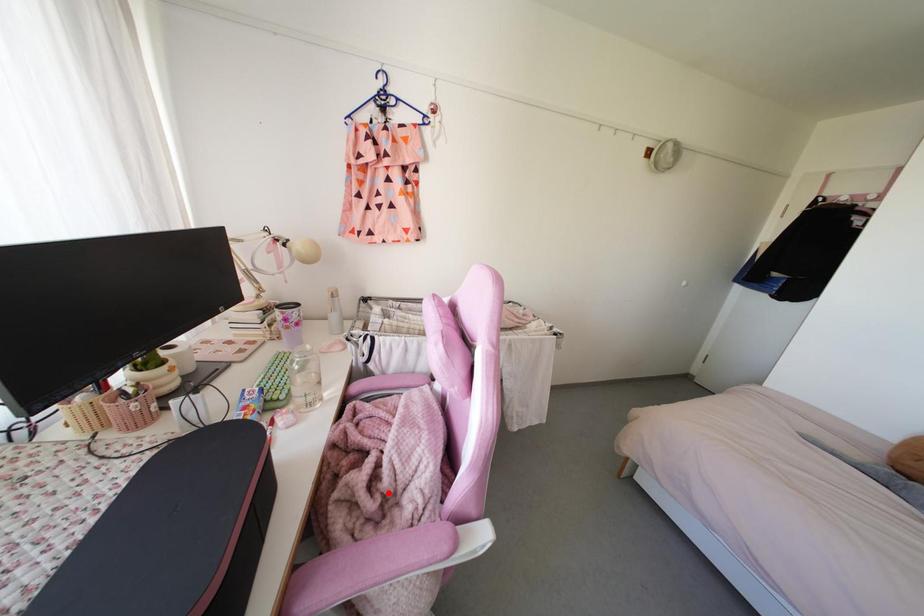
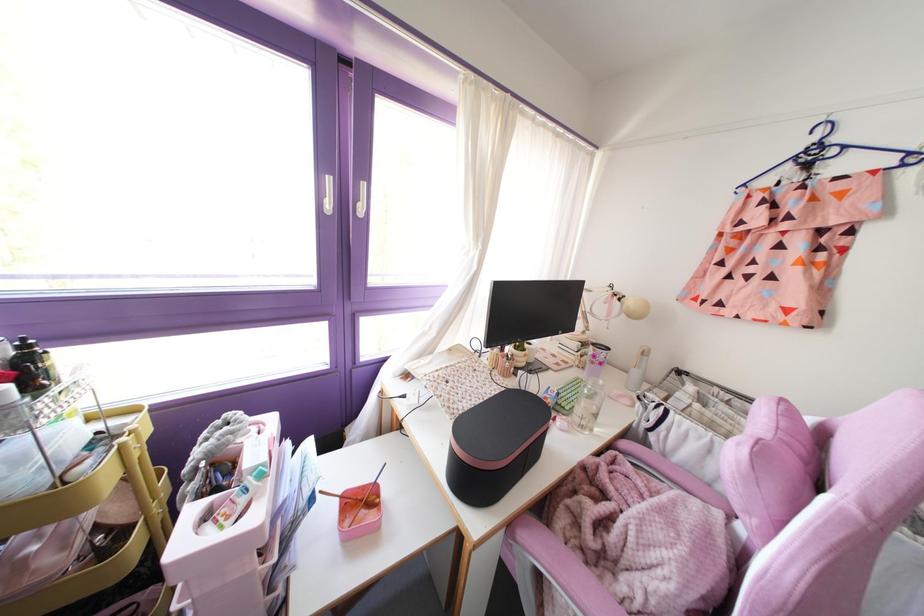
In the second image, find the point that corresponds to the highlighted location in the first image.

(610, 553)